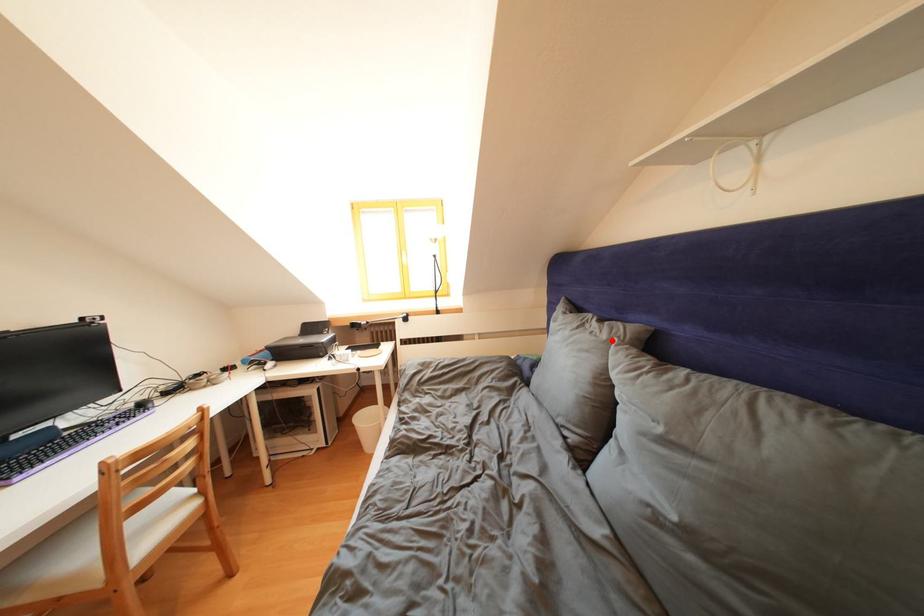
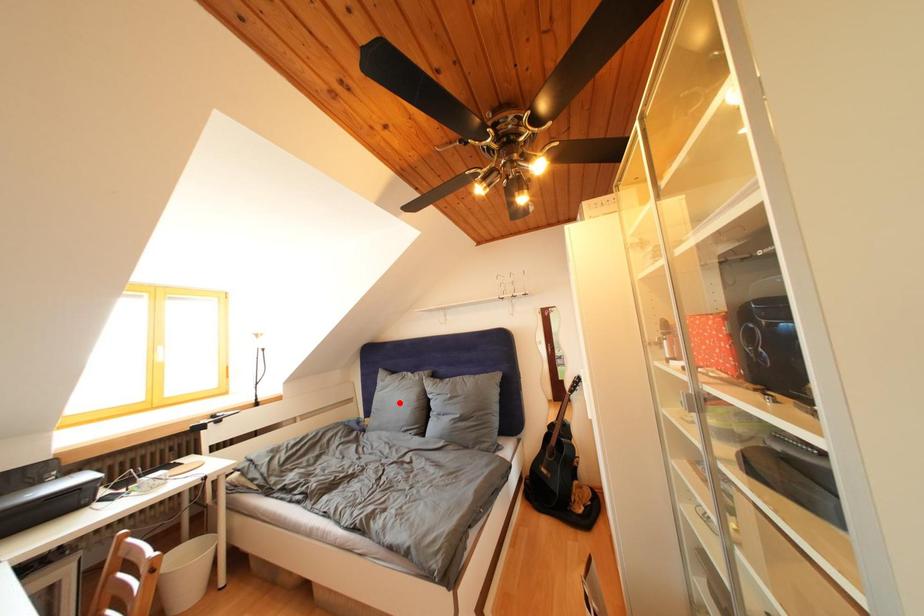
I am providing you with two images of the same scene from different viewpoints. A red point is marked on the first image and another point is marked on the second image. Do the highlighted points in image1 and image2 indicate the same real-world spot?

No